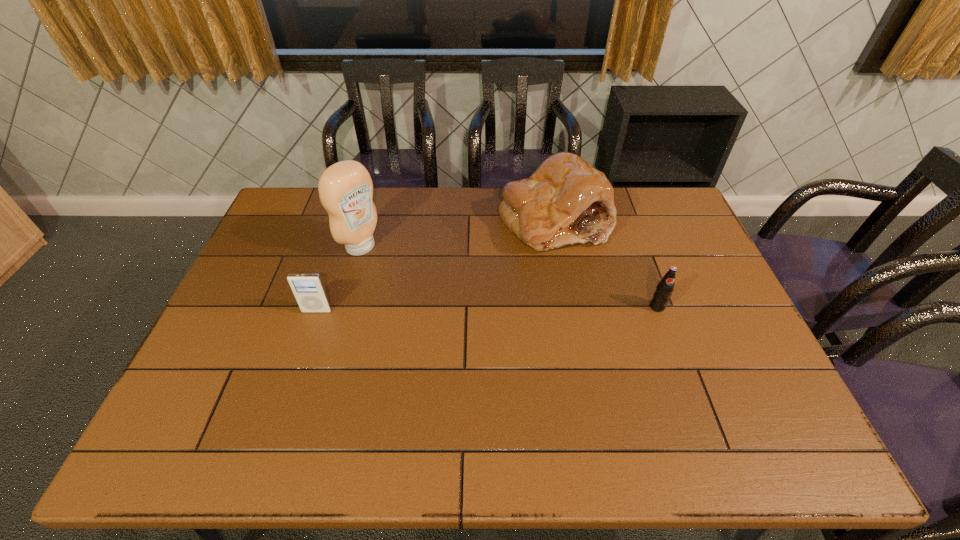
Image resolution: width=960 pixels, height=540 pixels. Identify the location of object identified as the second closest to the condiment. (566, 201).

Point out which object is positioned as the third nearest to the tallest object. Please provide its 2D coordinates. Your answer should be formatted as a tuple, i.e. [(x, y)], where the tuple contains the x and y coordinates of a point satisfying the conditions above.

[(665, 287)]